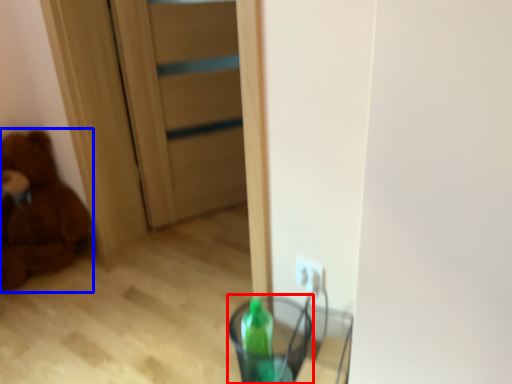
Question: Which object is closer to the camera taking this photo, glass vase (highlighted by a red box) or teddy bear (highlighted by a blue box)?

Choices:
 (A) glass vase
 (B) teddy bear

Answer: (A)